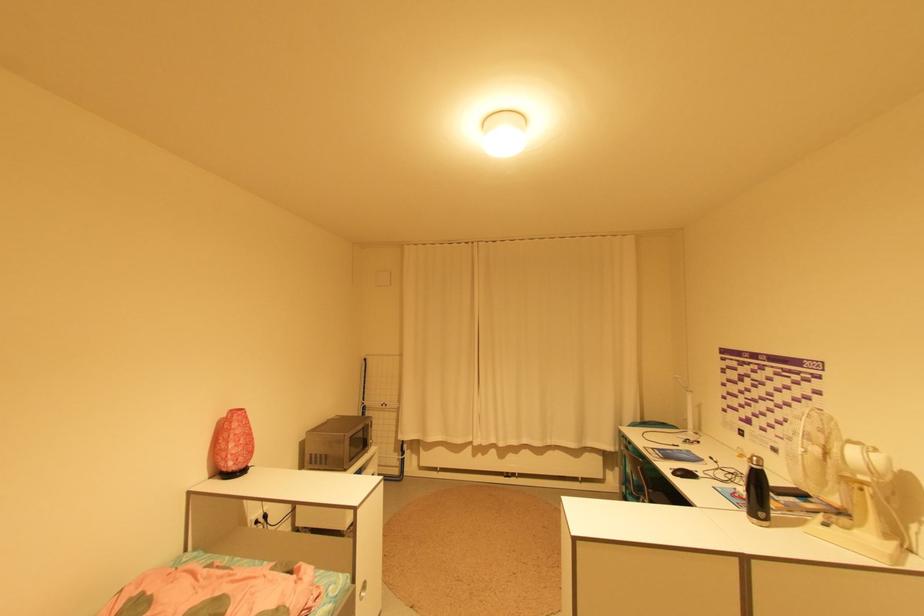
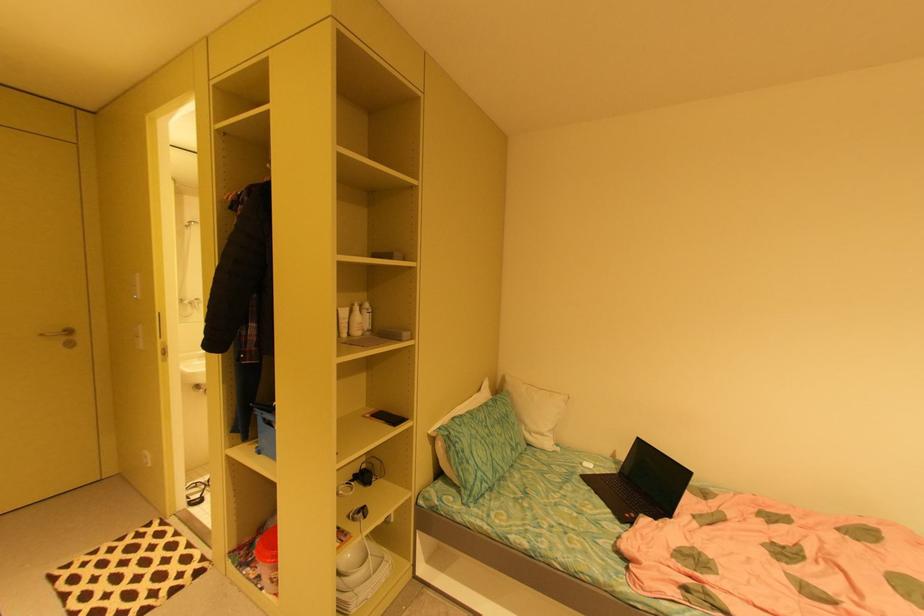
Question: Based on the continuous images, in which direction is the camera rotating? Reply with the corresponding letter.

Choices:
 (A) Left
 (B) Right
 (C) Up
 (D) Down

Answer: (A)